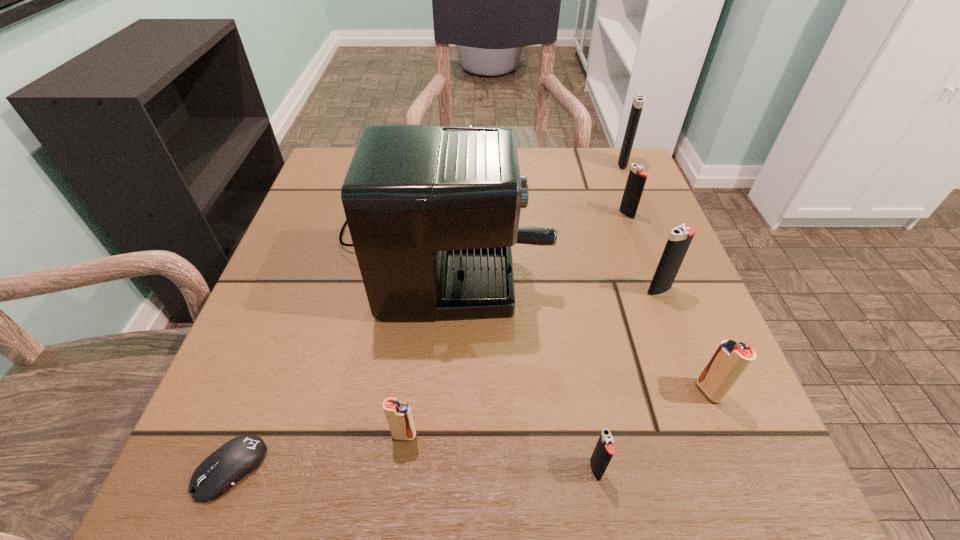
The width and height of the screenshot is (960, 540). Identify the location of vacant space situated 0.270m on the back of the bigger red igniter. (655, 257).

Locate an element on the screen. The height and width of the screenshot is (540, 960). vacant area situated 0.330m on the back of the left red igniter is located at coordinates (425, 264).

I want to click on vacant area situated on the left of the fourth object from left to right, so click(354, 469).

This screenshot has height=540, width=960. I want to click on vacant space located 0.100m on the back of the shortest object, so click(267, 374).

Where is `coffee maker located in the far edge section of the desktop`? This screenshot has width=960, height=540. coffee maker located in the far edge section of the desktop is located at coordinates (433, 211).

Identify the location of igniter present at the far edge. (637, 105).

This screenshot has height=540, width=960. Find the location of `computer equipment present at the near edge`. computer equipment present at the near edge is located at coordinates (219, 472).

The width and height of the screenshot is (960, 540). Find the location of `coffee maker present at the left edge`. coffee maker present at the left edge is located at coordinates (433, 211).

Where is `computer equipment located in the left edge section of the desktop`? This screenshot has height=540, width=960. computer equipment located in the left edge section of the desktop is located at coordinates (219, 472).

Identify the location of object that is at the far left corner. Image resolution: width=960 pixels, height=540 pixels. (433, 211).